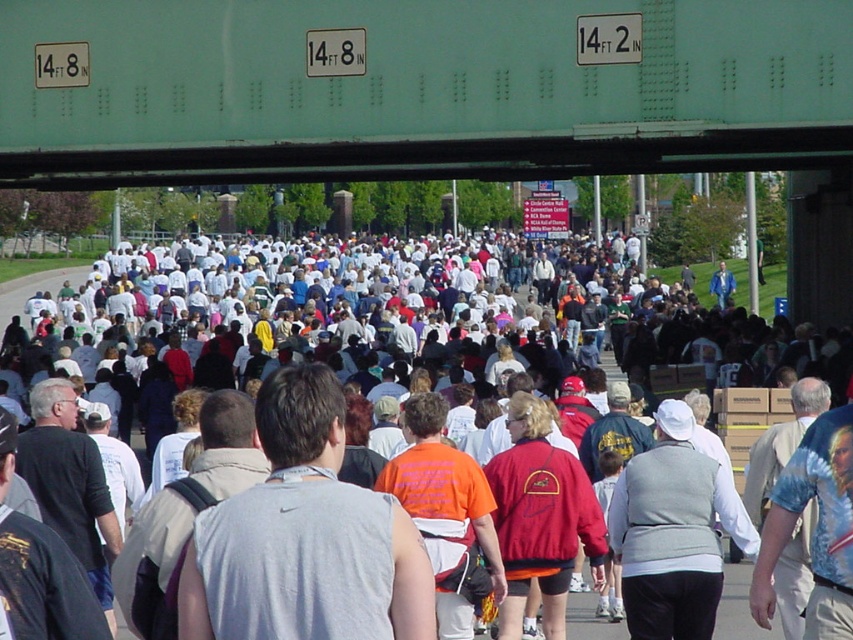
You are a drone operator trying to fly a drone through the gap between the teal metal bridge at upper center and the gray sleeveless shirt at center. Your drone has a maximum flight distance of 20 meters before needing to recharge. Can you safely fly your drone through this gap without needing to recharge?

The teal metal bridge at upper center and gray sleeveless shirt at center are 22.68 meters apart from each other. Since the drone can only fly 20 meters before needing to recharge, it cannot safely traverse the gap without recharging first.